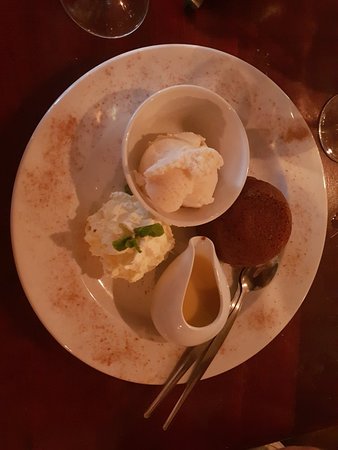
This screenshot has width=338, height=450. Find the location of `spoon`. spoon is located at coordinates (251, 290).